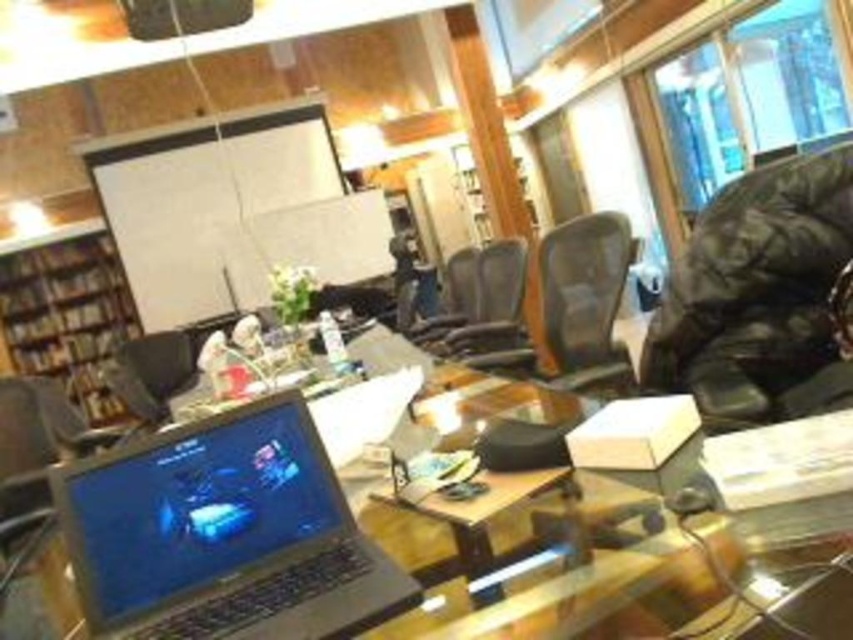
You are sitting in the matte black chair at center and want to reach the brown wooden bookshelf at left to grab a book. Which direction should you move to get closer to the bookshelf?

Since the brown wooden bookshelf at left is further to the viewer than the matte black chair at center, you should move forward to get closer to the bookshelf.

You are standing in the office and want to take a photo of both the laptop screen and the whiteboard. The laptop screen is at point (169, 518) and the whiteboard is at point (428, 330). Since you can only focus on one point at a time, which point should you focus on to ensure the laptop screen is in focus while the whiteboard is still somewhat visible?

You should focus on point (169, 518) because it is closer to the camera than point (428, 330). Focusing on the closer point will keep the laptop screen sharp, and the whiteboard at the farther point will still be somewhat visible but slightly out of focus.